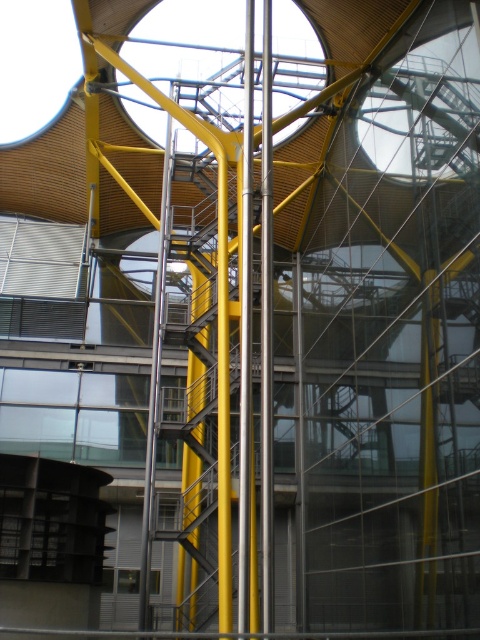
You are standing in front of the modern architectural structure and want to locate the point at coordinates point (247, 358). According to the scene description, where exactly is this point located?

The point (247, 358) is located on the polished metal pole at center.

You are standing at the entrance of the modern architectural structure and want to locate the polished metal pole at center. Based on the coordinates provided, where should you look to find it?

The polished metal pole at center is located at point [247,358], so you should look towards the central area of the structure to find it.